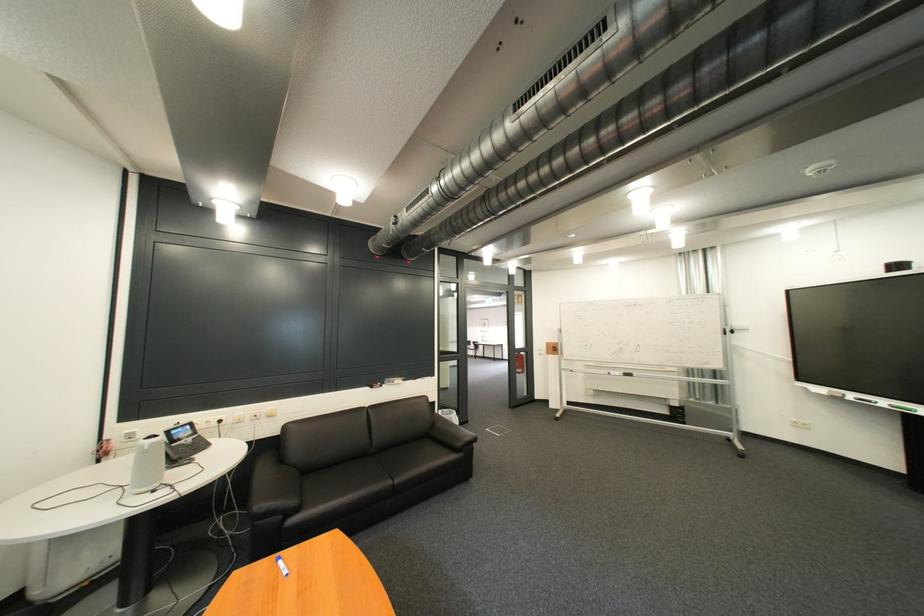
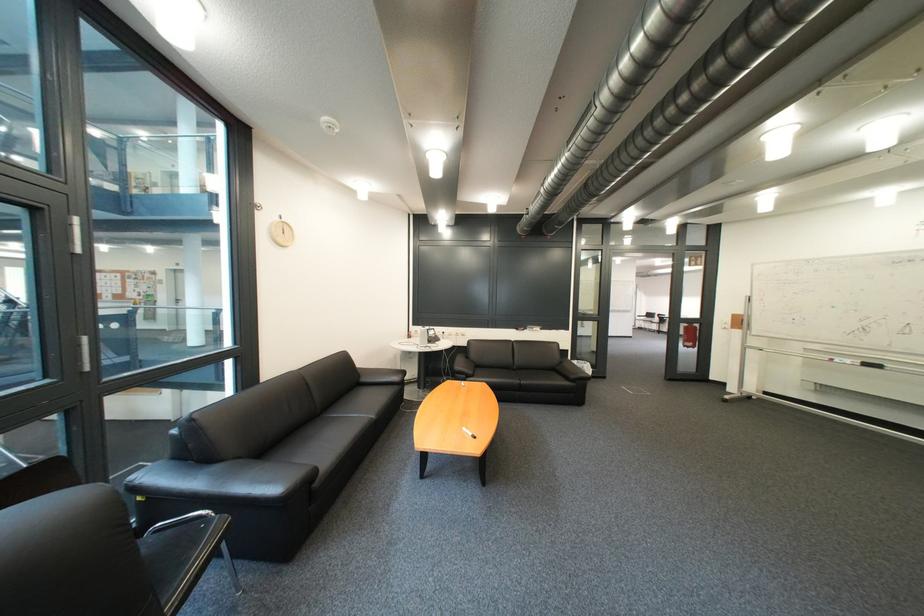
Where in the second image is the point corresponding to [138,421] from the first image?

(428, 326)